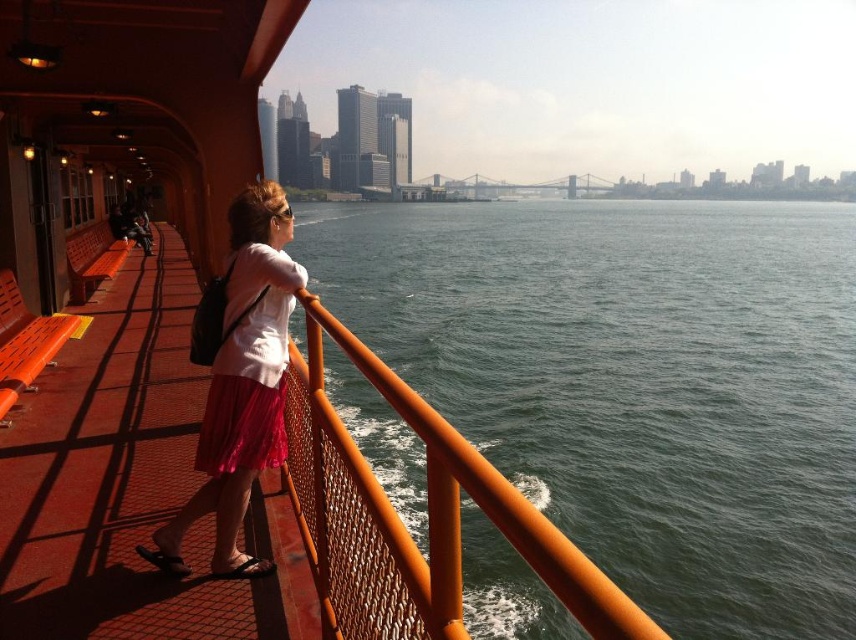
Who is positioned more to the left, orange mesh deck at center or pink pleated skirt at center?

orange mesh deck at center is more to the left.

Between point (259, 582) and point (218, 454), which one is positioned behind?

Positioned behind is point (259, 582).

Between point (76, 480) and point (284, 301), which one is positioned in front?

Positioned in front is point (284, 301).

This screenshot has width=856, height=640. I want to click on orange mesh deck at center, so click(131, 484).

Is green water at center closer to the viewer compared to pink satin skirt at center?

No, it is behind pink satin skirt at center.

Does green water at center have a greater width compared to pink satin skirt at center?

Correct, the width of green water at center exceeds that of pink satin skirt at center.

Locate an element on the screen. The width and height of the screenshot is (856, 640). green water at center is located at coordinates (635, 381).

The image size is (856, 640). Identify the location of green water at center. point(635,381).

Does pink satin skirt at center have a lesser height compared to pink pleated skirt at center?

No.

Between point (254, 424) and point (284, 312), which one is positioned behind?

Point (284, 312)

What are the coordinates of `pink satin skirt at center` in the screenshot? It's located at (242, 384).